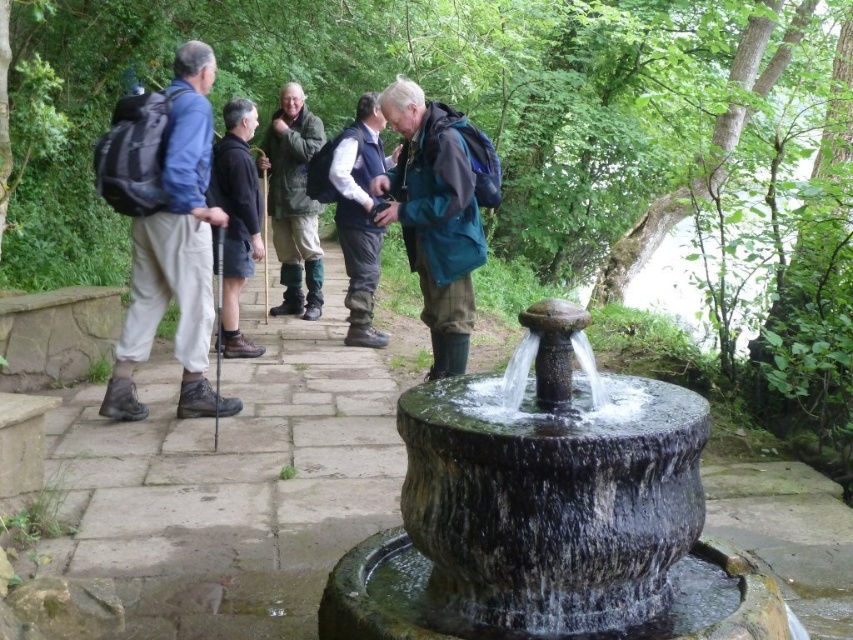
Question: Is dark gray stone fountain at center positioned before blue-green fabric vest at center?

Choices:
 (A) no
 (B) yes

Answer: (B)

Question: Is green matte jacket at center further to the viewer compared to green rubber boots at center?

Choices:
 (A) yes
 (B) no

Answer: (B)

Question: Which object is closer to the camera taking this photo?

Choices:
 (A) green matte jacket at center
 (B) blue-green fabric vest at center
 (C) matte blue jacket at left
 (D) brown stone path at center

Answer: (D)

Question: Among these points, which one is farthest from the camera?

Choices:
 (A) (457, 252)
 (B) (288, 221)
 (C) (167, 188)

Answer: (B)

Question: Which point is farther to the camera?

Choices:
 (A) (370, 474)
 (B) (215, 198)
 (C) (354, 147)
 (D) (273, 182)

Answer: (D)

Question: Is brown stone path at center closer to the viewer compared to green matte jacket at center?

Choices:
 (A) yes
 (B) no

Answer: (A)